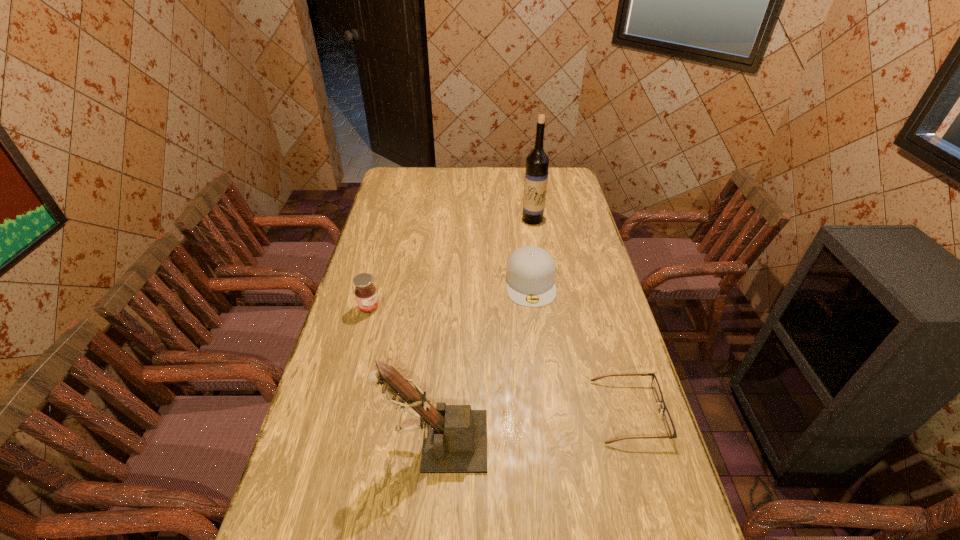
What are the coordinates of `object at the left edge` in the screenshot? It's located at tap(365, 292).

You are a GUI agent. You are given a task and a screenshot of the screen. Output one action in this format:
    pyautogui.click(x=<x>, y=<y>)
    Task: Click on the object present at the right edge
    This screenshot has width=960, height=540.
    Given the screenshot: What is the action you would take?
    (667, 419)

Identify the location of free space at the far edge. This screenshot has width=960, height=540. (426, 171).

Locate an element on the screen. The height and width of the screenshot is (540, 960). vacant space at the left edge of the desktop is located at coordinates (376, 317).

This screenshot has width=960, height=540. In the image, there is a desktop. Find the location of `free space at the right edge`. free space at the right edge is located at coordinates (609, 383).

At what (x,y) coordinates should I click in order to perform the action: click on vacant point at the far left corner. Please return your answer as a coordinate pair (x, y). Looking at the image, I should click on (411, 171).

This screenshot has height=540, width=960. In order to click on free space between the rightmost object and the wine bottle in this screenshot , I will do `click(581, 315)`.

The height and width of the screenshot is (540, 960). Find the location of `vacant space that is in between the fourth shortest object and the jam`. vacant space that is in between the fourth shortest object and the jam is located at coordinates (402, 374).

The image size is (960, 540). I want to click on free area in between the figurine and the farthest object, so pos(484,330).

Locate an element on the screen. The height and width of the screenshot is (540, 960). vacant space that is in between the second tallest object and the leftmost object is located at coordinates (402, 374).